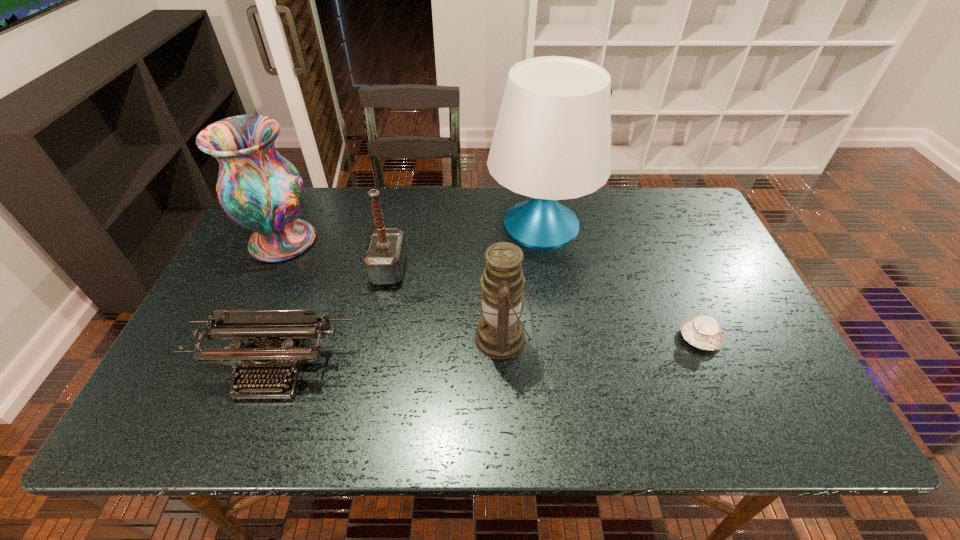
The image size is (960, 540). I want to click on blank area located on the right of the vase, so click(x=369, y=241).

Where is `free space located on the left of the oil lamp`? free space located on the left of the oil lamp is located at coordinates (417, 338).

Locate an element on the screen. The height and width of the screenshot is (540, 960). vacant region located on the left of the hammer is located at coordinates (266, 269).

Locate an element on the screen. vacant space located on the typing side of the typewriter is located at coordinates (254, 423).

The height and width of the screenshot is (540, 960). Find the location of `vacant space located on the side with the handle of the rightmost object`. vacant space located on the side with the handle of the rightmost object is located at coordinates (730, 410).

At what (x,y) coordinates should I click in order to perform the action: click on table lamp present at the far edge. Please return your answer as a coordinate pair (x, y). Image resolution: width=960 pixels, height=540 pixels. Looking at the image, I should click on (552, 141).

Where is `vase present at the far edge`? vase present at the far edge is located at coordinates (260, 190).

You are a GUI agent. You are given a task and a screenshot of the screen. Output one action in this format:
    pyautogui.click(x=<x>, y=<y>)
    Task: Click on the object that is at the near edge
    The image size is (960, 540).
    Given the screenshot: What is the action you would take?
    pyautogui.click(x=271, y=348)

At what (x,y) coordinates should I click in order to perform the action: click on vase that is positioned at the left edge. Please return your answer as a coordinate pair (x, y). This screenshot has width=960, height=540. Looking at the image, I should click on (260, 190).

Locate an element on the screen. The width and height of the screenshot is (960, 540). typewriter present at the left edge is located at coordinates (271, 348).